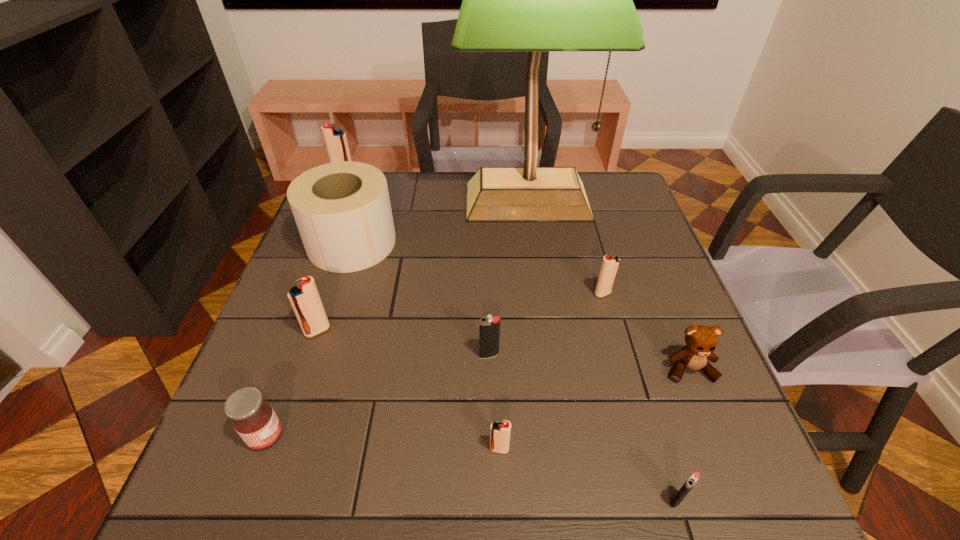
You are a GUI agent. You are given a task and a screenshot of the screen. Output one action in this format:
    pyautogui.click(x=<x>, y=<y>)
    Task: Click on the object that is at the near edge
    This screenshot has height=540, width=960.
    Given the screenshot: What is the action you would take?
    pyautogui.click(x=693, y=479)

The height and width of the screenshot is (540, 960). In order to click on toilet tissue that is positioned at the left edge in this screenshot , I will do `click(342, 210)`.

You are a GUI agent. You are given a task and a screenshot of the screen. Output one action in this format:
    pyautogui.click(x=<x>, y=<y>)
    Task: Click on the jam located in the left edge section of the desktop
    
    Given the screenshot: What is the action you would take?
    pyautogui.click(x=254, y=419)

The height and width of the screenshot is (540, 960). I want to click on table lamp located in the right edge section of the desktop, so click(x=534, y=0).

Identify the location of teddy bear present at the right edge. This screenshot has width=960, height=540. (701, 341).

Image resolution: width=960 pixels, height=540 pixels. Identify the location of object situated at the far left corner. (336, 143).

Identify the location of object present at the far right corner. (534, 0).

Where is `object that is at the near right corner`? The height and width of the screenshot is (540, 960). object that is at the near right corner is located at coordinates (693, 479).

In the image, there is a desktop. Identify the location of free region at the far edge. 462,172.

At what (x,y) coordinates should I click in order to perform the action: click on free space at the right edge. Please return your answer as a coordinate pair (x, y). Looking at the image, I should click on (634, 252).